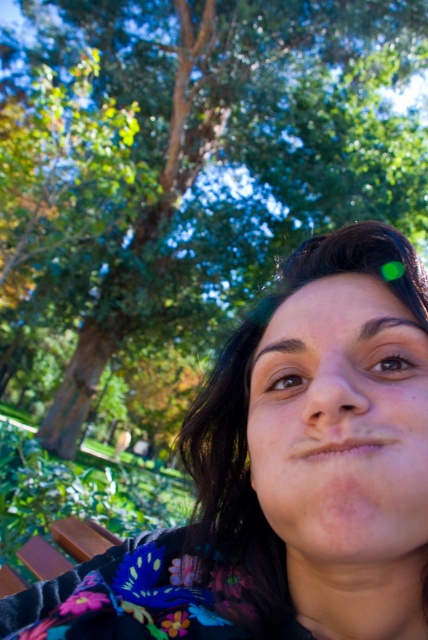
Which is above, floral fabric at center or green leafy tree at upper center?

green leafy tree at upper center is above.

Does floral fabric at center appear on the left side of green leafy tree at upper center?

Incorrect, floral fabric at center is not on the left side of green leafy tree at upper center.

Is point (407, 355) closer to viewer compared to point (261, 132)?

That is True.

You are a GUI agent. You are given a task and a screenshot of the screen. Output one action in this format:
    pyautogui.click(x=<x>, y=<y>)
    Task: Click on the floral fabric at center
    
    Given the screenshot: What is the action you would take?
    pyautogui.click(x=285, y=474)